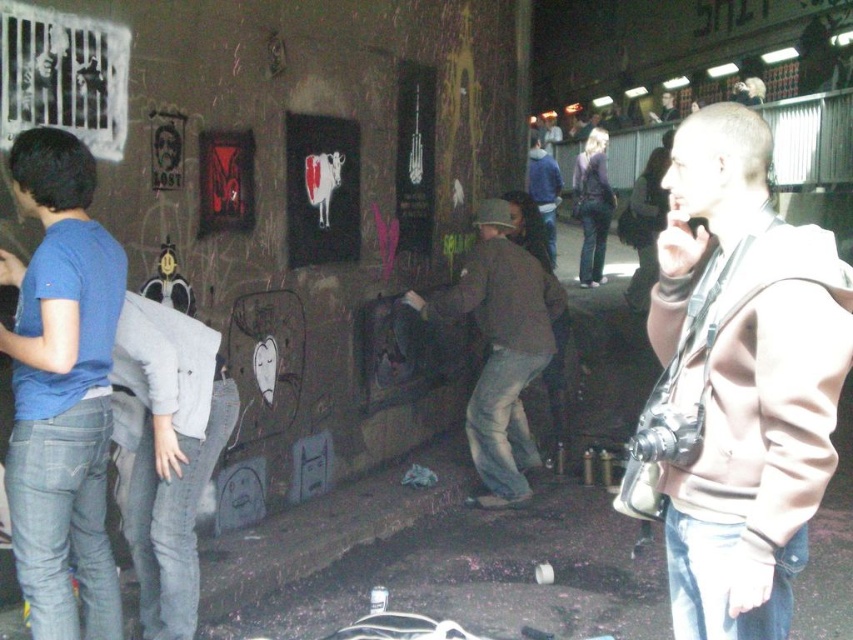
Question: Which is nearer to the denim jacket at upper center?

Choices:
 (A) light brown leather jacket at center
 (B) blue fleece jacket at center

Answer: (B)

Question: Considering the relative positions of brown cotton jacket at center and light brown leather jacket at center in the image provided, where is brown cotton jacket at center located with respect to light brown leather jacket at center?

Choices:
 (A) right
 (B) left

Answer: (B)

Question: Among these points, which one is farthest from the camera?

Choices:
 (A) (605, 141)
 (B) (531, 260)

Answer: (A)

Question: Is light brown hoodie at right positioned behind blue cotton t-shirt at left?

Choices:
 (A) yes
 (B) no

Answer: (B)

Question: Is light brown hoodie at right below denim jacket at upper center?

Choices:
 (A) no
 (B) yes

Answer: (B)

Question: Which object appears farthest from the camera in this image?

Choices:
 (A) denim jacket at upper center
 (B) blue fleece jacket at center
 (C) light brown leather jacket at center

Answer: (A)